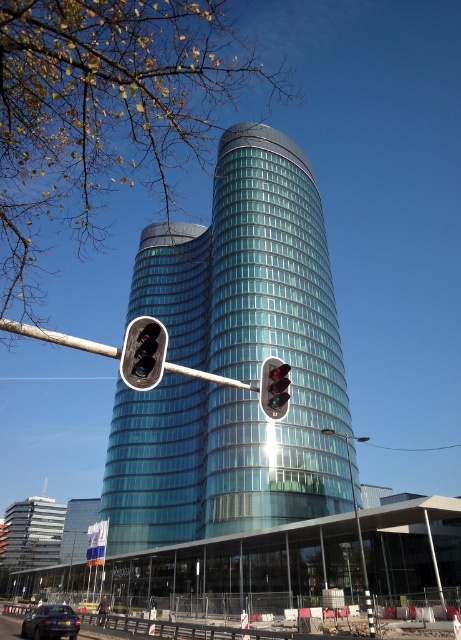
Question: Which point is farther to the camera?

Choices:
 (A) green glass traffic light at center
 (B) metallic blue sedan at lower left
 (C) matte black traffic light at center
 (D) glassy teal skyscraper at center

Answer: (D)

Question: In this image, where is glassy teal skyscraper at center located relative to matte black traffic light at center?

Choices:
 (A) right
 (B) left

Answer: (B)

Question: Does metallic traffic light at left appear over matte black traffic light at center?

Choices:
 (A) no
 (B) yes

Answer: (A)

Question: Does matte black traffic light at center appear under green glass traffic light at center?

Choices:
 (A) no
 (B) yes

Answer: (A)

Question: Which object is farther from the camera taking this photo?

Choices:
 (A) glassy teal skyscraper at center
 (B) metallic blue sedan at lower left
 (C) matte black traffic light at center
 (D) green glass traffic light at center

Answer: (A)

Question: Which object is closer to the camera taking this photo?

Choices:
 (A) metallic blue sedan at lower left
 (B) glassy teal skyscraper at center
 (C) green glass traffic light at center
 (D) matte black traffic light at center

Answer: (D)